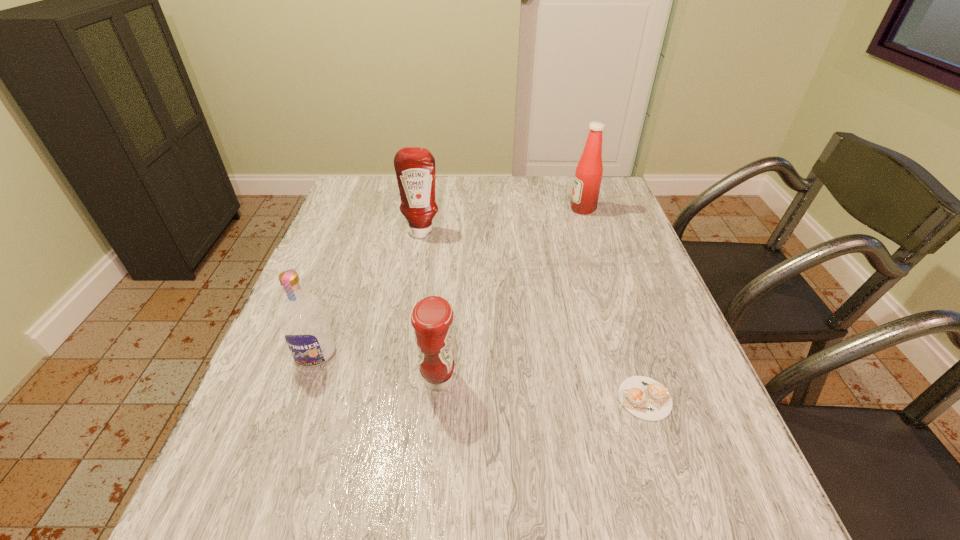
The height and width of the screenshot is (540, 960). I want to click on vacant space that's between the shortest object and the vodka, so click(480, 376).

You are a GUI agent. You are given a task and a screenshot of the screen. Output one action in this format:
    pyautogui.click(x=<x>, y=<y>)
    Task: Click on the unoccupied position between the shortest object and the shortest condiment
    The width and height of the screenshot is (960, 540).
    Given the screenshot: What is the action you would take?
    pyautogui.click(x=541, y=389)

Locate which object is the fourth closest to the nearest condiment. Please provide its 2D coordinates. Your answer should be formatted as a tuple, i.e. [(x, y)], where the tuple contains the x and y coordinates of a point satisfying the conditions above.

[(588, 176)]

Point out which object is positioned as the nearest to the vodka. Please provide its 2D coordinates. Your answer should be formatted as a tuple, i.e. [(x, y)], where the tuple contains the x and y coordinates of a point satisfying the conditions above.

[(431, 318)]

The image size is (960, 540). Find the location of `condiment object that ranks as the second closest to the leftmost object`. condiment object that ranks as the second closest to the leftmost object is located at coordinates pos(415,167).

You are a GUI agent. You are given a task and a screenshot of the screen. Output one action in this format:
    pyautogui.click(x=<x>, y=<y>)
    Task: Click on the condiment object that ranks as the second closest to the leftmost object
    The width and height of the screenshot is (960, 540).
    Given the screenshot: What is the action you would take?
    pyautogui.click(x=415, y=167)

The width and height of the screenshot is (960, 540). In order to click on free spot that satisfies the following two spatial constraints: 1. on the front-facing side of the cappuccino; 2. on the right side of the farthest object in this screenshot , I will do `click(644, 399)`.

Image resolution: width=960 pixels, height=540 pixels. Find the location of `vacant area in the image that satisfies the following two spatial constraints: 1. on the label of the leftmost object; 2. on the left side of the cappuccino`. vacant area in the image that satisfies the following two spatial constraints: 1. on the label of the leftmost object; 2. on the left side of the cappuccino is located at coordinates (x=300, y=399).

Locate an element on the screen. vacant area that satisfies the following two spatial constraints: 1. on the front side of the shortest condiment; 2. on the right side of the second nearest condiment is located at coordinates (396, 380).

Locate an element on the screen. The width and height of the screenshot is (960, 540). vacant area in the image that satisfies the following two spatial constraints: 1. on the label of the leftmost object; 2. on the left side of the shortest object is located at coordinates (300, 399).